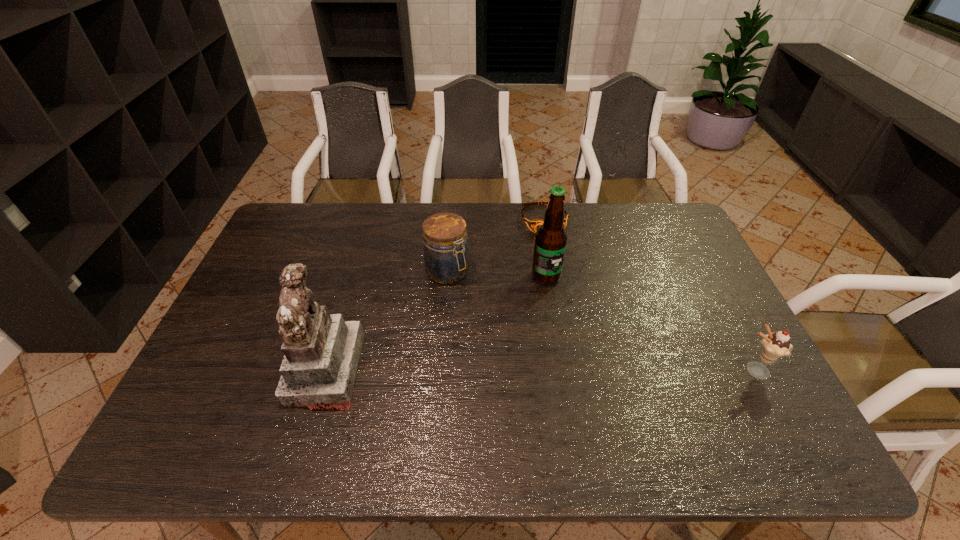
The image size is (960, 540). I want to click on free space between the beer bottle and the jar, so click(496, 274).

Identify the location of unoccupied area between the beer bottle and the figurine. [x=436, y=323].

Locate an element on the screen. This screenshot has width=960, height=540. unoccupied area between the beer bottle and the jar is located at coordinates (496, 274).

At what (x,y) coordinates should I click in order to perform the action: click on vacant area between the icecream and the farthest object. Please return your answer as a coordinate pair (x, y). The image size is (960, 540). Looking at the image, I should click on (649, 295).

Locate an element on the screen. Image resolution: width=960 pixels, height=540 pixels. empty space between the icecream and the second object from left to right is located at coordinates (600, 321).

Find the location of a particular element. The image size is (960, 540). empty space between the farthest object and the fourth object from right to left is located at coordinates (495, 246).

Identify the location of free space between the jar and the leftmost object. (387, 320).

Image resolution: width=960 pixels, height=540 pixels. What are the coordinates of `blank region between the jar and the leftmost object` in the screenshot? It's located at (387, 320).

You are a GUI agent. You are given a task and a screenshot of the screen. Output one action in this format:
    pyautogui.click(x=<x>, y=<y>)
    Task: Click on the empty location between the jar and the beer bottle
    The width and height of the screenshot is (960, 540).
    Given the screenshot: What is the action you would take?
    pyautogui.click(x=496, y=274)

At what (x,y) coordinates should I click in order to perform the action: click on vacant point located between the second object from left to right and the goggles. Please return your answer as a coordinate pair (x, y). The height and width of the screenshot is (540, 960). Looking at the image, I should click on (495, 246).